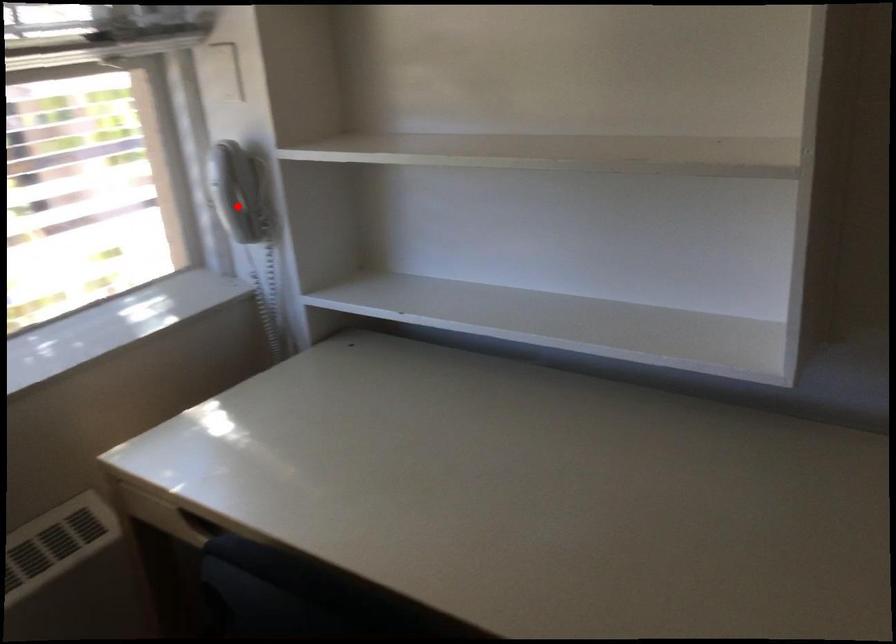
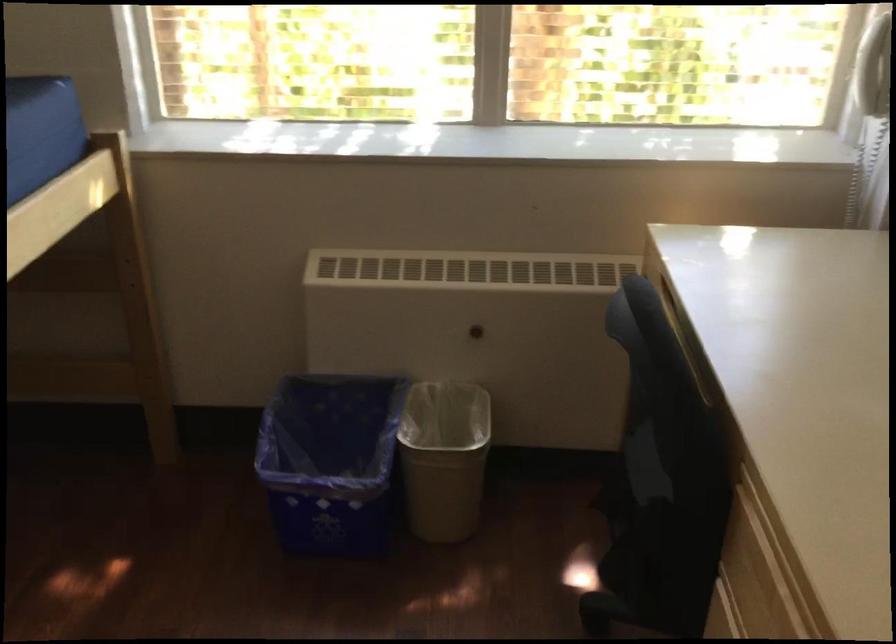
Where in the second image is the point corresponding to the highlighted location from the first image?

(874, 69)